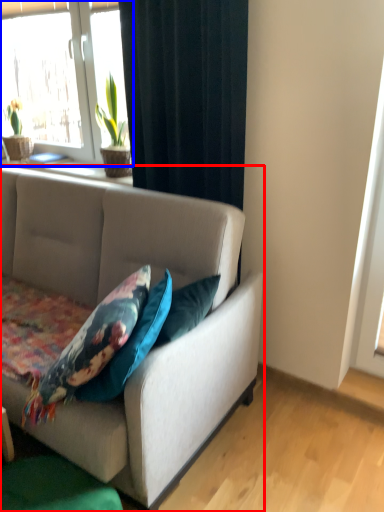
Question: Among these objects, which one is nearest to the camera, studio couch (highlighted by a red box) or window (highlighted by a blue box)?

Choices:
 (A) studio couch
 (B) window

Answer: (A)